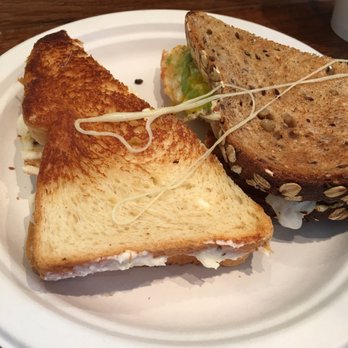
This screenshot has height=348, width=348. Find the location of `plate`. plate is located at coordinates (292, 285).